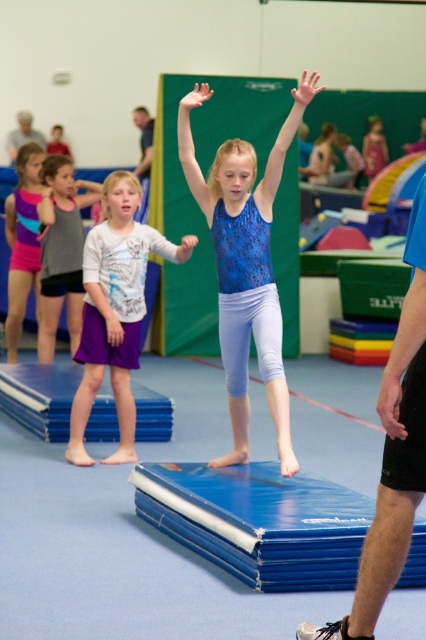
Question: Which object is farther from the camera taking this photo?

Choices:
 (A) blue shirt at upper center
 (B) matte purple shorts at left
 (C) purple cotton skirt at left

Answer: (A)

Question: Does gray fabric tank top at left appear over blue shirt at upper center?

Choices:
 (A) no
 (B) yes

Answer: (A)

Question: Which is farther from the purple cotton skirt at left?

Choices:
 (A) blue fabric shorts at lower right
 (B) gray fabric shirt at upper left
 (C) matte purple shorts at left

Answer: (B)

Question: Is blue fabric gymnast at center closer to camera compared to gray fabric shirt at upper left?

Choices:
 (A) yes
 (B) no

Answer: (A)

Question: Which point appears closest to the camera in this image?

Choices:
 (A) (62, 186)
 (B) (28, 125)

Answer: (A)

Question: Can you confirm if purple cotton skirt at left is wider than blue fabric gymnast at center?

Choices:
 (A) no
 (B) yes

Answer: (B)